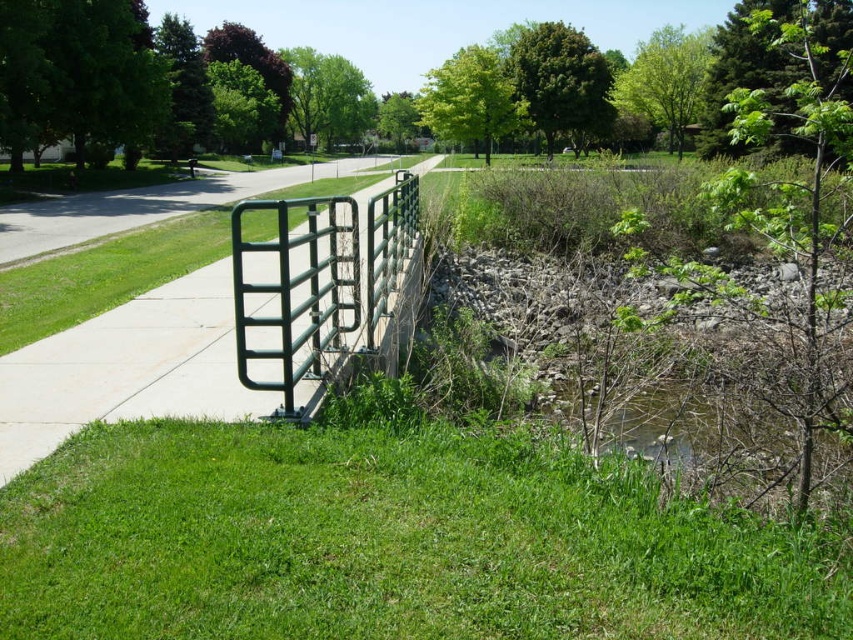
Does green grass at lower center appear under green matte metal gate at center?

Yes, green grass at lower center is below green matte metal gate at center.

Consider the image. Does green grass at lower center have a greater height compared to green matte metal gate at center?

No, green grass at lower center is not taller than green matte metal gate at center.

Locate an element on the screen. green grass at lower center is located at coordinates (381, 544).

Can you confirm if green grass at lower center is taller than green metal fence at center?

Incorrect, green grass at lower center's height is not larger of green metal fence at center's.

Who is shorter, green grass at lower center or green metal fence at center?

green grass at lower center

Is point (39, 509) in front of point (50, 432)?

Yes, it is in front of point (50, 432).

Where is `green grass at lower center`? The height and width of the screenshot is (640, 853). green grass at lower center is located at coordinates coord(381,544).

What do you see at coordinates (128, 369) in the screenshot? This screenshot has width=853, height=640. I see `green metal fence at center` at bounding box center [128, 369].

Identify the location of green metal fence at center. (128, 369).